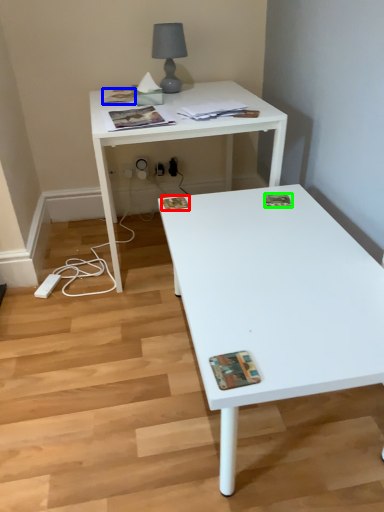
Question: Considering the real-world distances, which object is farthest from magazine (highlighted by a red box)? magazine (highlighted by a blue box) or magazine (highlighted by a green box)?

Choices:
 (A) magazine
 (B) magazine

Answer: (A)